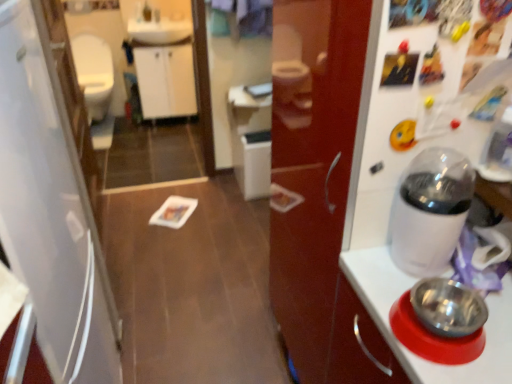
Question: Would you say white matte refrigerator at left is part of white glossy sink at upper center's contents?

Choices:
 (A) no
 (B) yes

Answer: (A)

Question: Is white glossy sink at upper center to the right of white matte refrigerator at left from the viewer's perspective?

Choices:
 (A) no
 (B) yes

Answer: (A)

Question: Does white glossy sink at upper center lie in front of white matte refrigerator at left?

Choices:
 (A) yes
 (B) no

Answer: (B)

Question: Does white glossy sink at upper center have a greater width compared to white matte refrigerator at left?

Choices:
 (A) no
 (B) yes

Answer: (A)

Question: From a real-world perspective, is white glossy sink at upper center physically above white matte refrigerator at left?

Choices:
 (A) yes
 (B) no

Answer: (A)

Question: From a real-world perspective, is white matte refrigerator at left above or below white glossy coffee maker at right?

Choices:
 (A) below
 (B) above

Answer: (A)

Question: Which is correct: white matte refrigerator at left is inside white glossy coffee maker at right, or outside of it?

Choices:
 (A) outside
 (B) inside

Answer: (A)

Question: From the image's perspective, relative to white glossy coffee maker at right, is white matte refrigerator at left above or below?

Choices:
 (A) below
 (B) above

Answer: (A)

Question: Does point (11, 51) appear closer or farther from the camera than point (428, 148)?

Choices:
 (A) closer
 (B) farther

Answer: (A)

Question: In the image, is matte white faucet at upper center on the left side or the right side of white glossy mirror at upper center?

Choices:
 (A) right
 (B) left

Answer: (B)

Question: From the image's perspective, is matte white faucet at upper center positioned above or below white glossy mirror at upper center?

Choices:
 (A) below
 (B) above

Answer: (B)

Question: Based on their sizes in the image, would you say matte white faucet at upper center is bigger or smaller than white glossy mirror at upper center?

Choices:
 (A) big
 (B) small

Answer: (B)

Question: From a real-world perspective, relative to white glossy mirror at upper center, is matte white faucet at upper center vertically above or below?

Choices:
 (A) below
 (B) above

Answer: (B)

Question: Considering the positions of point (104, 71) and point (4, 147), is point (104, 71) closer or farther from the camera than point (4, 147)?

Choices:
 (A) closer
 (B) farther

Answer: (B)

Question: Looking at the image, does white glossy toilet bowl at left seem bigger or smaller compared to white matte refrigerator at left?

Choices:
 (A) small
 (B) big

Answer: (A)